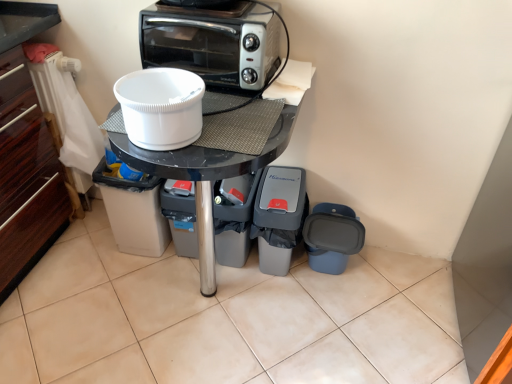
Question: Is the depth of white plastic bucket at center, placed as the fifth appliance when sorted from right to left, greater than that of blue plastic trash can at lower right, the fifth appliance when ordered from left to right?

Choices:
 (A) no
 (B) yes

Answer: (A)

Question: Is white plastic bucket at center, the first appliance in the left-to-right sequence, taller than blue plastic trash can at lower right, the 1th appliance positioned from the right?

Choices:
 (A) no
 (B) yes

Answer: (B)

Question: Does white plastic bucket at center, the first appliance in the left-to-right sequence, have a lesser height compared to blue plastic trash can at lower right, the 1th appliance positioned from the right?

Choices:
 (A) no
 (B) yes

Answer: (A)

Question: Considering the relative sizes of white plastic bucket at center, placed as the fifth appliance when sorted from right to left, and blue plastic trash can at lower right, the fifth appliance when ordered from left to right, in the image provided, is white plastic bucket at center, placed as the fifth appliance when sorted from right to left, bigger than blue plastic trash can at lower right, the fifth appliance when ordered from left to right,?

Choices:
 (A) no
 (B) yes

Answer: (B)

Question: Would you consider white plastic bucket at center, placed as the fifth appliance when sorted from right to left, to be distant from blue plastic trash can at lower right, the 1th appliance positioned from the right?

Choices:
 (A) no
 (B) yes

Answer: (A)

Question: In the image, is white plastic bowl at center, the 2th appliance viewed from the left, positioned in front of or behind gray plastic trash can at lower center, which is the 3th appliance from left to right?

Choices:
 (A) front
 (B) behind

Answer: (A)

Question: Considering the positions of white plastic bowl at center, which is the fourth appliance in right-to-left order, and gray plastic trash can at lower center, which is the 3th appliance from left to right, in the image, is white plastic bowl at center, which is the fourth appliance in right-to-left order, wider or thinner than gray plastic trash can at lower center, which is the 3th appliance from left to right,?

Choices:
 (A) thin
 (B) wide

Answer: (A)

Question: From a real-world perspective, is white plastic bowl at center, which is the fourth appliance in right-to-left order, above or below gray plastic trash can at lower center, which is counted as the 3th appliance, starting from the right?

Choices:
 (A) above
 (B) below

Answer: (A)

Question: Choose the correct answer: Is white plastic bowl at center, the 2th appliance viewed from the left, inside gray plastic trash can at lower center, which is counted as the 3th appliance, starting from the right, or outside it?

Choices:
 (A) outside
 (B) inside

Answer: (A)

Question: From a real-world perspective, is gray plastic trash can at lower center, which is the 3th appliance from left to right, above or below white plastic bowl at center, the 2th appliance viewed from the left?

Choices:
 (A) above
 (B) below

Answer: (B)

Question: Is gray plastic trash can at lower center, which is counted as the 3th appliance, starting from the right, to the left or to the right of white plastic bowl at center, which is the fourth appliance in right-to-left order, in the image?

Choices:
 (A) left
 (B) right

Answer: (B)

Question: Considering the positions of gray plastic trash can at lower center, which is counted as the 3th appliance, starting from the right, and white plastic bowl at center, the 2th appliance viewed from the left, in the image, is gray plastic trash can at lower center, which is counted as the 3th appliance, starting from the right, taller or shorter than white plastic bowl at center, the 2th appliance viewed from the left,?

Choices:
 (A) tall
 (B) short

Answer: (A)

Question: From the image's perspective, is gray plastic trash can at lower center, which is the 3th appliance from left to right, located above or below white plastic bowl at center, the 2th appliance viewed from the left?

Choices:
 (A) below
 (B) above

Answer: (A)

Question: From the image's perspective, is black glossy table at center located above or below blue plastic trash can at lower right, the fifth appliance when ordered from left to right?

Choices:
 (A) above
 (B) below

Answer: (A)

Question: Is black glossy table at center in front of or behind blue plastic trash can at lower right, the fifth appliance when ordered from left to right, in the image?

Choices:
 (A) behind
 (B) front

Answer: (B)